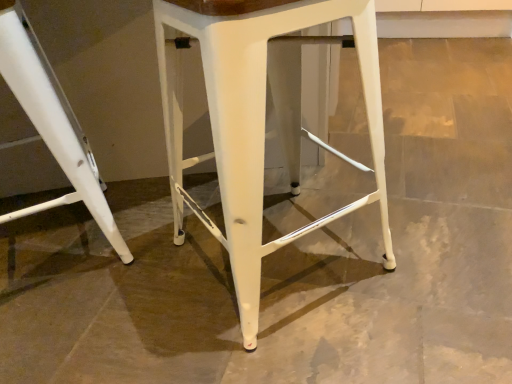
Question: Is white metal stool at center, the second stool viewed from the left, to the left or to the right of white matte stool at left, positioned as the first stool in left-to-right order, in the image?

Choices:
 (A) right
 (B) left

Answer: (A)

Question: Is point (375, 33) closer or farther from the camera than point (78, 180)?

Choices:
 (A) closer
 (B) farther

Answer: (A)

Question: From a real-world perspective, is white metal stool at center, the second stool viewed from the left, physically located above or below white matte stool at left, positioned as the first stool in left-to-right order?

Choices:
 (A) below
 (B) above

Answer: (B)

Question: Is white matte stool at left, the 2th stool when ordered from right to left, bigger or smaller than white metal stool at center, which is counted as the first stool, starting from the right?

Choices:
 (A) big
 (B) small

Answer: (B)

Question: From the image's perspective, is white matte stool at left, the 2th stool when ordered from right to left, located above or below white metal stool at center, the second stool viewed from the left?

Choices:
 (A) below
 (B) above

Answer: (B)

Question: From their relative heights in the image, would you say white matte stool at left, the 2th stool when ordered from right to left, is taller or shorter than white metal stool at center, which is counted as the first stool, starting from the right?

Choices:
 (A) tall
 (B) short

Answer: (B)

Question: Is white matte stool at left, the 2th stool when ordered from right to left, in front of or behind white metal stool at center, the second stool viewed from the left, in the image?

Choices:
 (A) front
 (B) behind

Answer: (B)